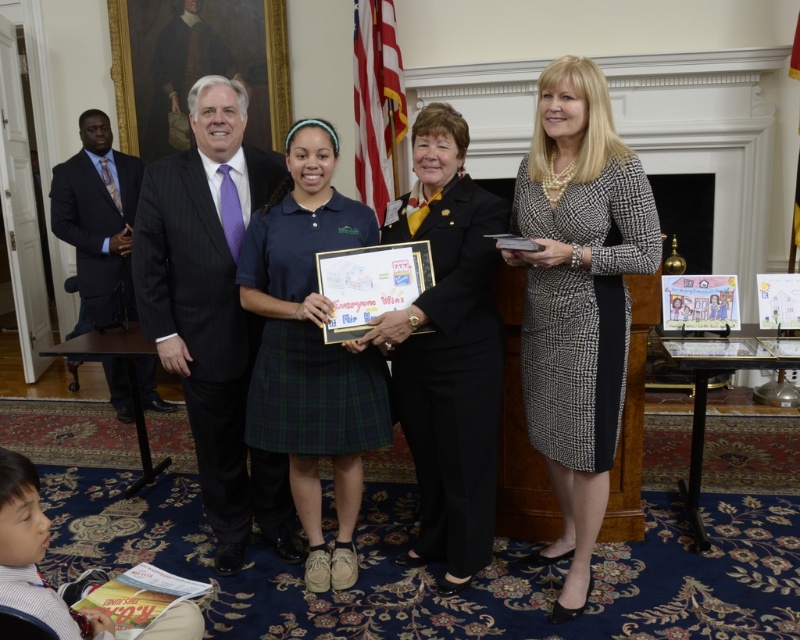
Identify the location of dark gray pinstripe suit at center. (212, 310).

From the picture: Is dark gray pinstripe suit at center positioned at the back of dark blue suit at left?

No.

Does point (220, 305) come behind point (108, 280)?

No, it is not.

Find the location of `dark gray pinstripe suit at center`. dark gray pinstripe suit at center is located at coordinates (212, 310).

Which of these two, black wool suit at center or dark blue suit at left, stands shorter?

dark blue suit at left is shorter.

Can you confirm if black wool suit at center is positioned above dark blue suit at left?

No.

Which is in front, point (417, 461) or point (96, 120)?

Positioned in front is point (417, 461).

Where is `black wool suit at center`? This screenshot has height=640, width=800. black wool suit at center is located at coordinates (448, 352).

Which of these two, black and white textured dress at center or dark blue suit at left, stands shorter?

With less height is dark blue suit at left.

Describe the element at coordinates (578, 300) in the screenshot. I see `black and white textured dress at center` at that location.

Locate an element on the screen. black and white textured dress at center is located at coordinates tap(578, 300).